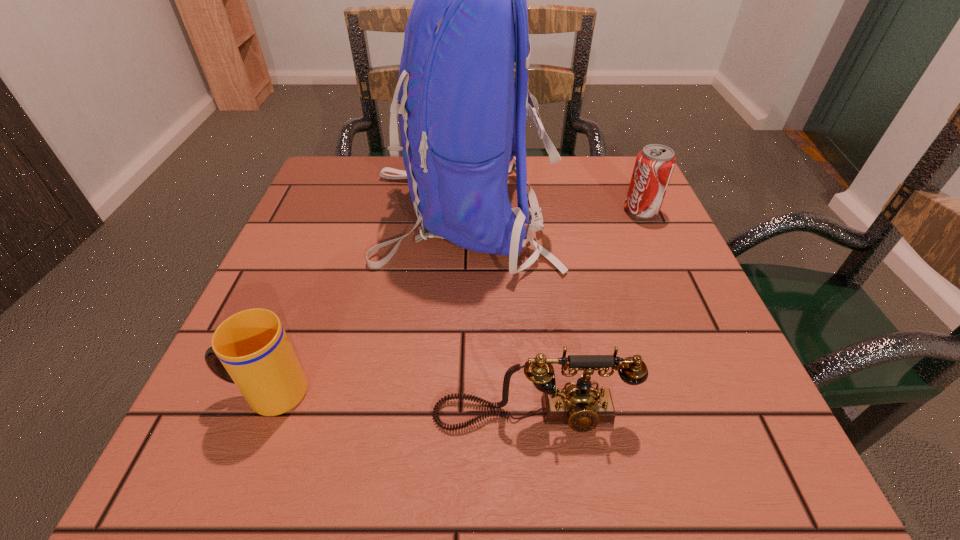
Locate an element on the screen. The height and width of the screenshot is (540, 960). vacant space at the far right corner is located at coordinates (594, 161).

Where is `vacant space in between the telephone and the soda can`? vacant space in between the telephone and the soda can is located at coordinates (587, 313).

This screenshot has height=540, width=960. In order to click on free space that is in between the cup and the backpack in this screenshot , I will do `click(365, 302)`.

The image size is (960, 540). I want to click on unoccupied area between the telephone and the cup, so click(400, 404).

Locate an element on the screen. This screenshot has width=960, height=540. free space between the soda can and the cup is located at coordinates (454, 301).

Identify the location of free point between the rightmost object and the cup. 454,301.

The height and width of the screenshot is (540, 960). In order to click on free area in between the backpack and the leftmost object in this screenshot , I will do `click(365, 302)`.

You are a GUI agent. You are given a task and a screenshot of the screen. Output one action in this format:
    pyautogui.click(x=<x>, y=<y>)
    Task: Click on the vacant point located between the cup and the telephone
    
    Given the screenshot: What is the action you would take?
    pyautogui.click(x=400, y=404)

The image size is (960, 540). Identify the location of free space between the cup and the backpack. (365, 302).

You are a GUI agent. You are given a task and a screenshot of the screen. Output one action in this format:
    pyautogui.click(x=<x>, y=<y>)
    Task: Click on the free space between the soda can and the tallest object
    
    Given the screenshot: What is the action you would take?
    pyautogui.click(x=552, y=212)